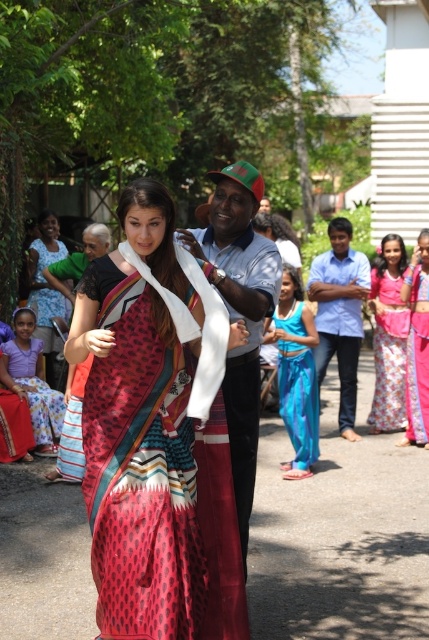
Question: Which point is farther from the camera taking this photo?

Choices:
 (A) (338, 298)
 (B) (162, 531)
 (C) (383, 285)
 (D) (76, 461)

Answer: (C)

Question: Does matte blue shirt at center appear under matte black saree at left?

Choices:
 (A) no
 (B) yes

Answer: (B)

Question: Is blue cotton shirt at center smaller than purple cotton dress at lower left?

Choices:
 (A) yes
 (B) no

Answer: (B)

Question: Which point is closer to the camera?

Choices:
 (A) (54, 304)
 (B) (350, 352)

Answer: (B)

Question: Can you confirm if matte blue shirt at center is positioned to the left of pink floral saree at center?

Choices:
 (A) no
 (B) yes

Answer: (B)

Question: Which point is closer to the camera?

Choices:
 (A) (396, 332)
 (B) (136, 349)
 (C) (425, 241)

Answer: (B)